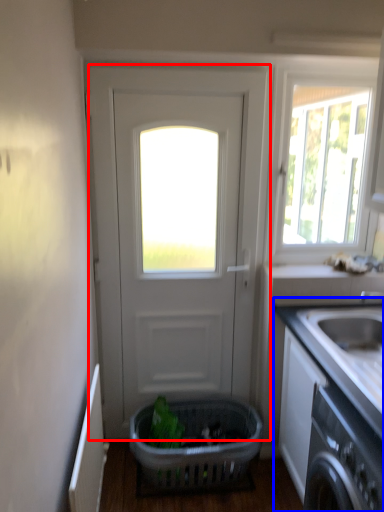
Question: Which object is closer to the camera taking this photo, door (highlighted by a red box) or countertop (highlighted by a blue box)?

Choices:
 (A) door
 (B) countertop

Answer: (B)